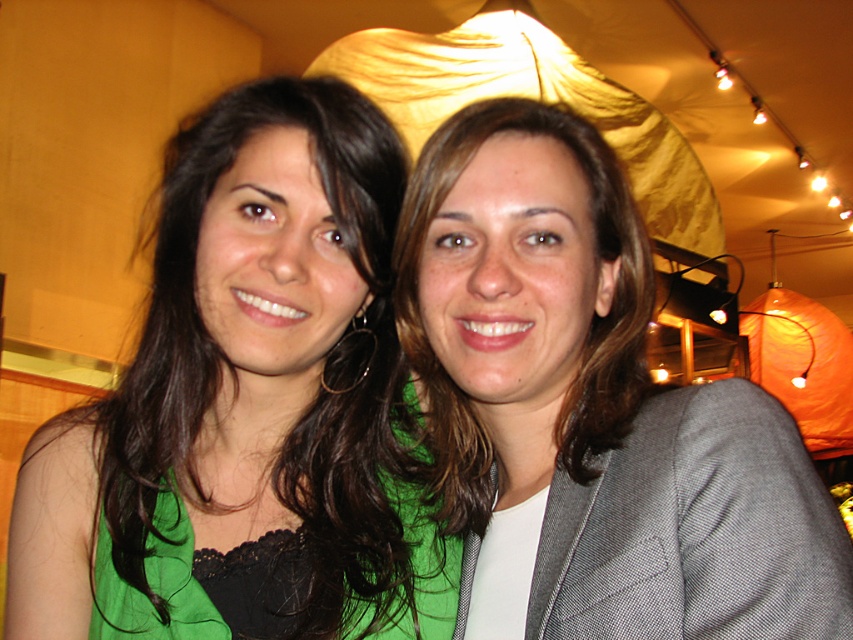
Question: Can you confirm if green fabric at left is positioned to the left of matte gray blazer at center?

Choices:
 (A) no
 (B) yes

Answer: (B)

Question: Which object is farther from the camera taking this photo?

Choices:
 (A) green fabric jacket at upper right
 (B) green fabric at left
 (C) matte gray blazer at center

Answer: (B)

Question: Does green fabric jacket at upper right have a larger size compared to matte gray blazer at center?

Choices:
 (A) no
 (B) yes

Answer: (B)

Question: Which point is closer to the camera?

Choices:
 (A) matte gray blazer at center
 (B) green fabric jacket at upper right
 (C) green fabric at left

Answer: (B)

Question: Is green fabric at left to the left of matte gray blazer at center from the viewer's perspective?

Choices:
 (A) yes
 (B) no

Answer: (A)

Question: Which point is closer to the camera taking this photo?

Choices:
 (A) [x=281, y=184]
 (B) [x=532, y=362]
 (C) [x=618, y=189]

Answer: (B)